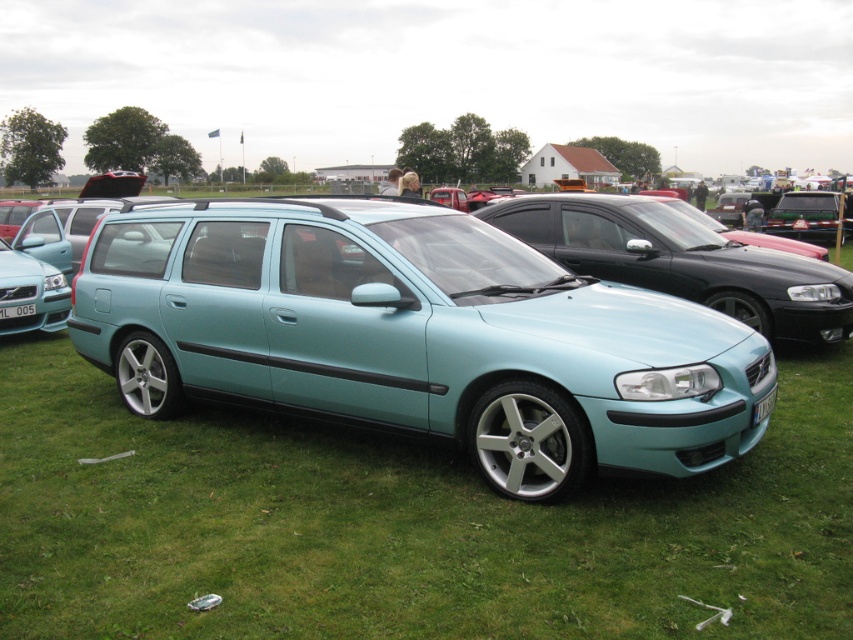
Question: Considering the relative positions of light blue metallic sedan at center and green metallic license plate at front in the image provided, where is light blue metallic sedan at center located with respect to green metallic license plate at front?

Choices:
 (A) above
 (B) below

Answer: (A)

Question: Which of the following is the closest to the observer?

Choices:
 (A) (13, 314)
 (B) (165, 224)
 (C) (610, 230)
 (D) (766, 412)

Answer: (D)

Question: Does light blue metallic sedan at center have a smaller size compared to teal metallic station wagon at center?

Choices:
 (A) yes
 (B) no

Answer: (B)

Question: Can you confirm if green metallic license plate at front is positioned above white plastic license plate at center?

Choices:
 (A) yes
 (B) no

Answer: (B)

Question: Which object is closer to the camera taking this photo?

Choices:
 (A) white plastic license plate at center
 (B) green metallic license plate at front
 (C) light blue metallic sedan at center
 (D) teal metallic station wagon at center

Answer: (C)

Question: Which of the following is the closest to the observer?

Choices:
 (A) (773, 400)
 (B) (161, 323)
 (C) (3, 317)

Answer: (A)